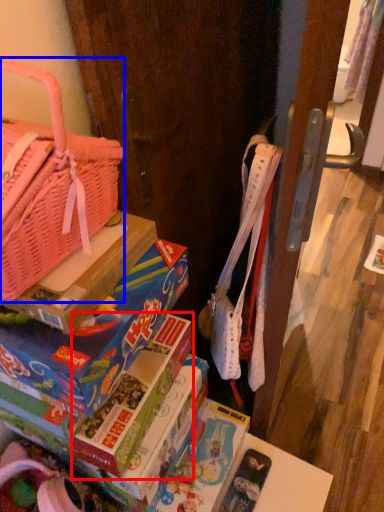
Question: Which point is further to the camera, paperback book (highlighted by a red box) or handbag (highlighted by a blue box)?

Choices:
 (A) paperback book
 (B) handbag

Answer: (A)